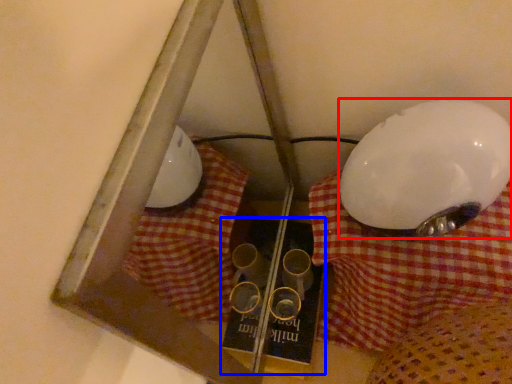
Question: Which of the following is the farthest to the observer, lamp (highlighted by a red box) or book (highlighted by a blue box)?

Choices:
 (A) lamp
 (B) book

Answer: (B)